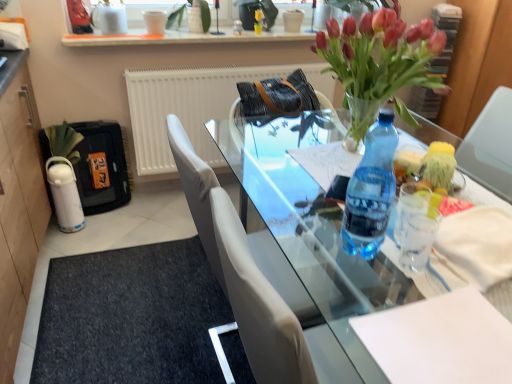
At what (x,y) coordinates should I click in order to perform the action: click on blank space situated above white paper at center (from a real-world perspective). Please return your answer as a coordinate pair (x, y). Looking at the image, I should click on (446, 334).